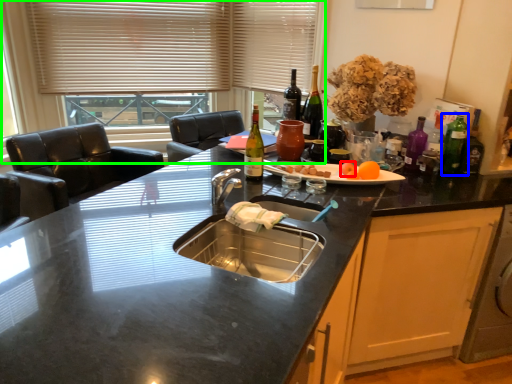
Question: Which is nearer to the food (highlighted by a red box)? bottle (highlighted by a blue box) or window (highlighted by a green box).

Choices:
 (A) bottle
 (B) window

Answer: (A)